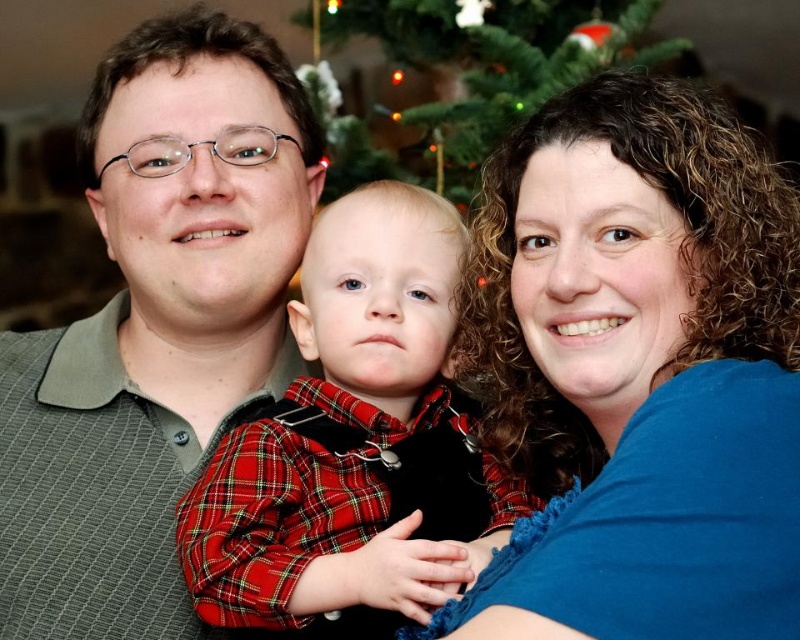
You are standing in front of the family portrait and want to place a small decoration between the two points labeled point (x=342, y=524) and point (x=374, y=24). Which point should you place it closer to so that it appears closer to the front of the image?

You should place the decoration closer to point (x=342, y=524) because it is in front of point (x=374, y=24), so it will appear closer to the front of the image.